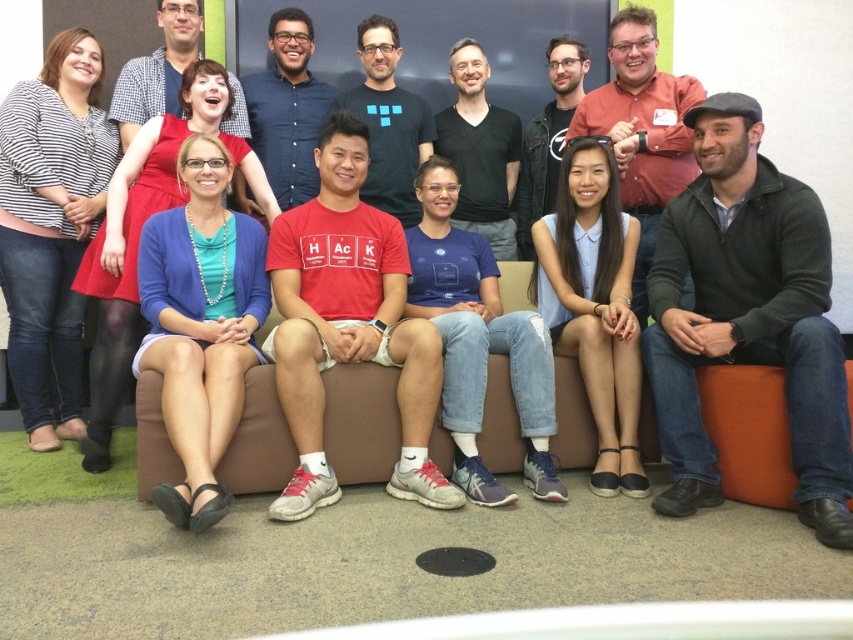
Question: Is the position of striped cotton shirt at left less distant than that of matte red shirt at center?

Choices:
 (A) yes
 (B) no

Answer: (B)

Question: Which is farther from the matte black t-shirt at center?

Choices:
 (A) dark green sweater at right
 (B) matte blue cardigan at center

Answer: (B)

Question: Among these points, which one is nearest to the camera?

Choices:
 (A) (577, 131)
 (B) (280, 156)
 (C) (399, 202)
 (D) (48, 301)

Answer: (D)

Question: Considering the relative positions of black matte shirt at center and matte black t-shirt at center in the image provided, where is black matte shirt at center located with respect to matte black t-shirt at center?

Choices:
 (A) left
 (B) right

Answer: (A)

Question: Where is black matte shirt at center located in relation to matte black t-shirt at center in the image?

Choices:
 (A) below
 (B) above

Answer: (A)

Question: Which object appears farthest from the camera in this image?

Choices:
 (A) dark green sweater at right
 (B) white cotton t-shirt at center
 (C) matte blue cardigan at lower left

Answer: (B)